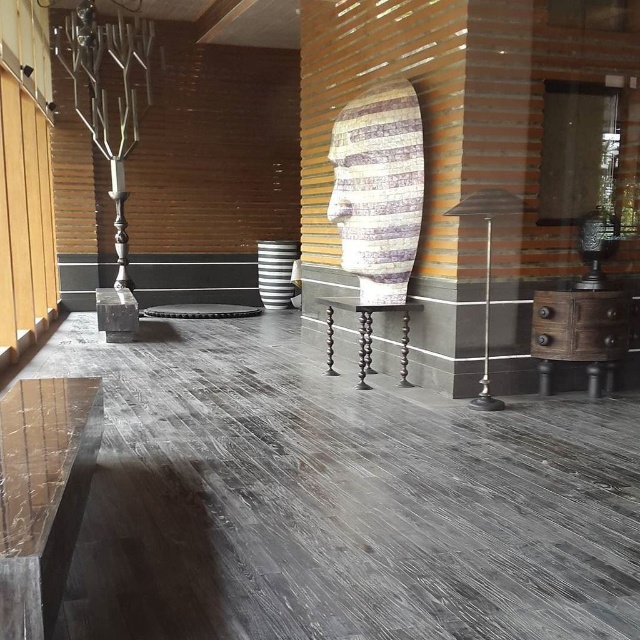
Based on the photo, is polished brass candle holder at center thinner than bronze textured candle holder at right?

In fact, polished brass candle holder at center might be wider than bronze textured candle holder at right.

Between polished brass candle holder at center and bronze textured candle holder at right, which one has less height?

Standing shorter between the two is bronze textured candle holder at right.

You are a GUI agent. You are given a task and a screenshot of the screen. Output one action in this format:
    pyautogui.click(x=<x>, y=<y>)
    Task: Click on the polished brass candle holder at center
    
    Given the screenshot: What is the action you would take?
    pyautogui.click(x=486, y=269)

Locate an element on the screen. This screenshot has width=640, height=640. polished brass candle holder at center is located at coordinates (486, 269).

Consider the image. Does polished brass candle holder at center come in front of polished dark wood stool at center?

Yes, it is in front of polished dark wood stool at center.

The image size is (640, 640). Describe the element at coordinates (486, 269) in the screenshot. I see `polished brass candle holder at center` at that location.

Locate an element on the screen. Image resolution: width=640 pixels, height=640 pixels. polished brass candle holder at center is located at coordinates (486, 269).

Between bronze textured candle holder at right and silver polished pillar at left, which one is positioned higher?

silver polished pillar at left

Who is more distant from viewer, (579, 243) or (112, 160)?

Positioned behind is point (112, 160).

Find the location of a particular element. The height and width of the screenshot is (640, 640). bronze textured candle holder at right is located at coordinates (596, 244).

Where is `bronze textured candle holder at right`? bronze textured candle holder at right is located at coordinates (596, 244).